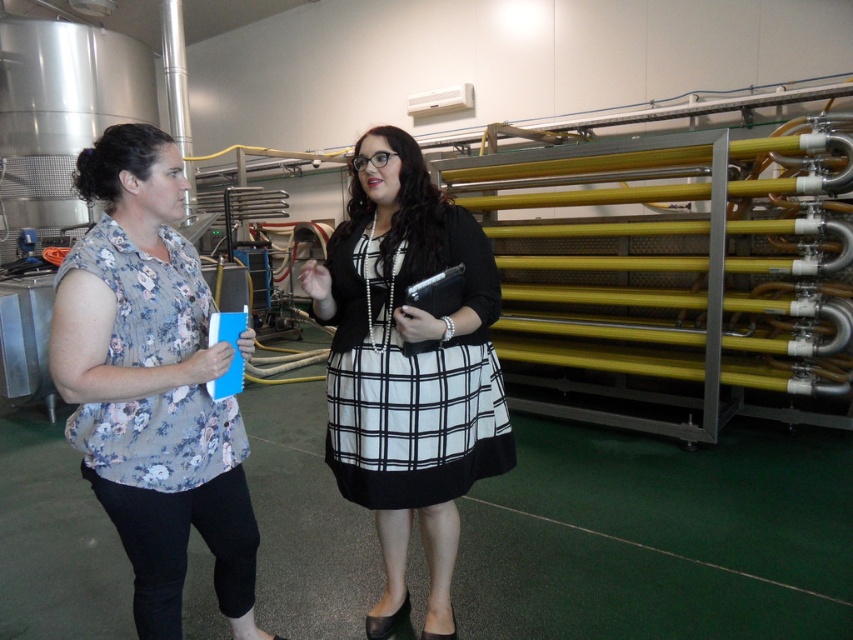
Is point (96, 305) positioned before point (494, 396)?

Yes, point (96, 305) is closer to viewer.

Is the position of floral fabric blouse at left more distant than that of matte black dress at center?

No, floral fabric blouse at left is closer to the viewer.

Find the location of a particular element. floral fabric blouse at left is located at coordinates (152, 385).